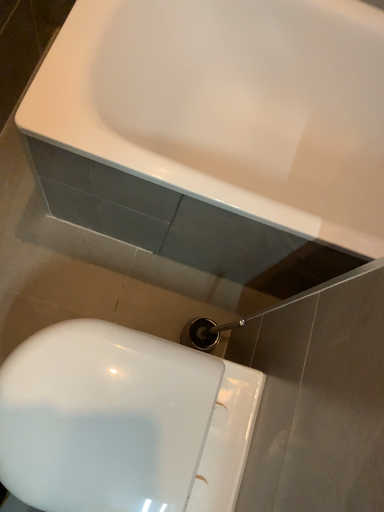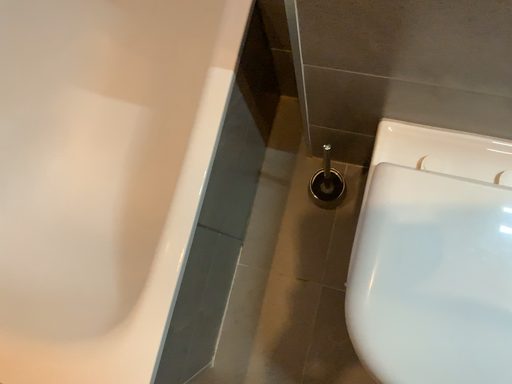
Question: How did the camera likely rotate when shooting the video?

Choices:
 (A) rotated left
 (B) rotated right

Answer: (B)